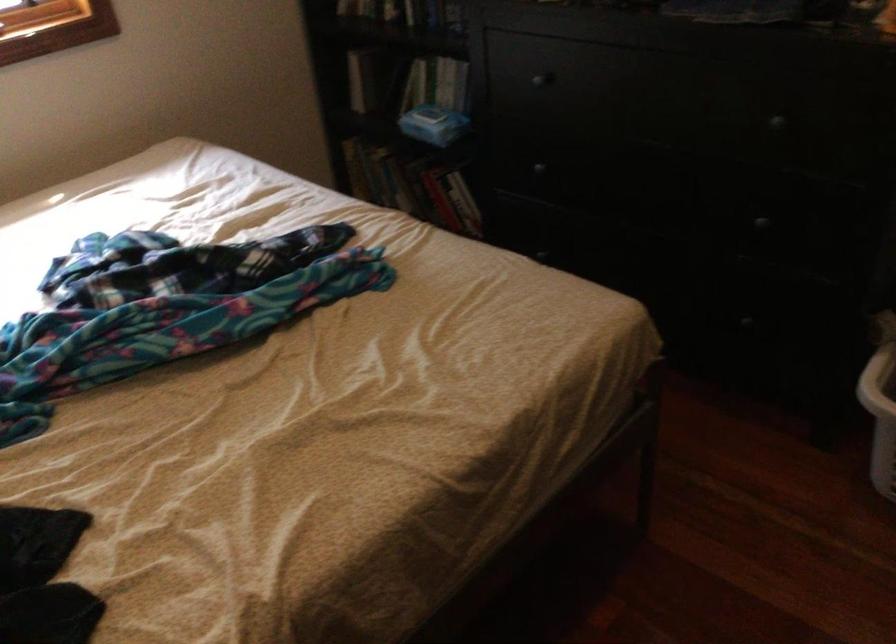
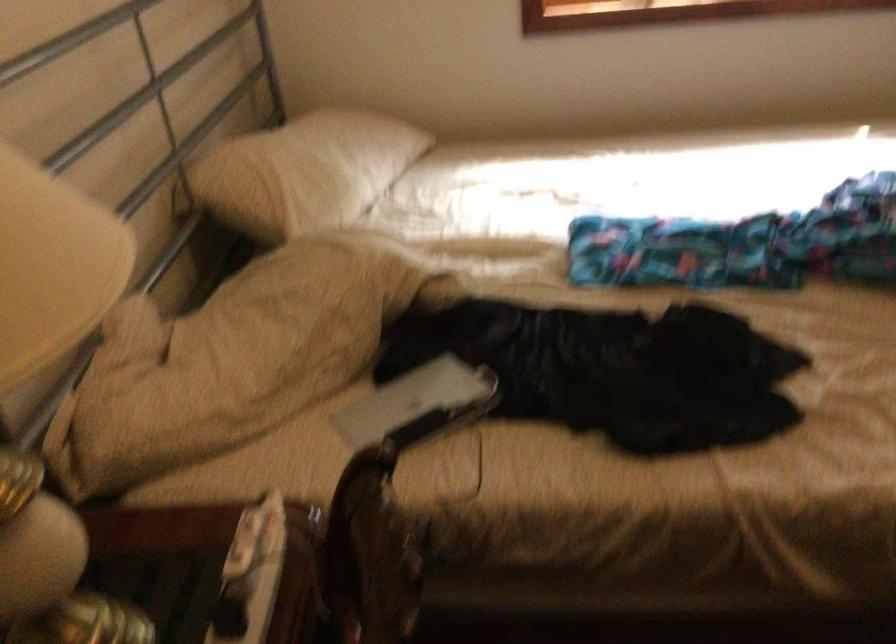
Question: How did the camera likely rotate?

Choices:
 (A) Left
 (B) Right
 (C) Up
 (D) Down

Answer: (A)